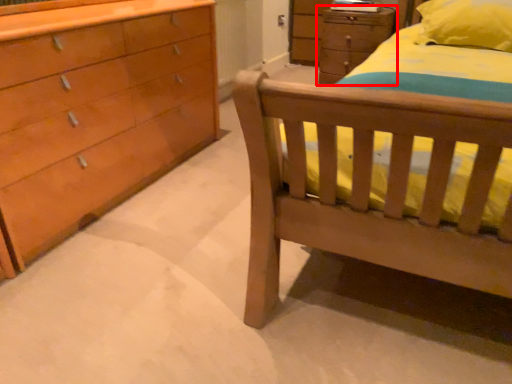
Question: From the image's perspective, where is chest of drawers (annotated by the red box) located relative to pillow?

Choices:
 (A) below
 (B) above

Answer: (B)